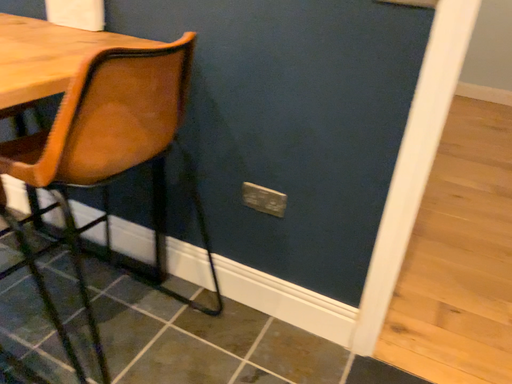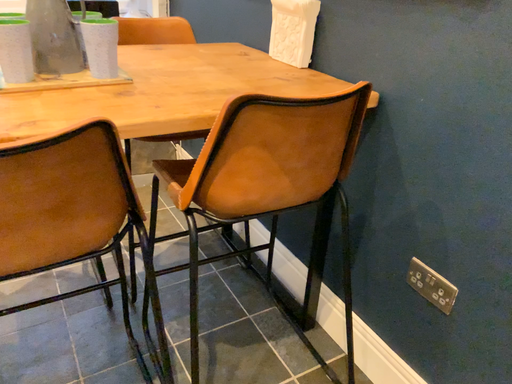
Question: Which way did the camera rotate in the video?

Choices:
 (A) rotated upward
 (B) rotated downward

Answer: (A)